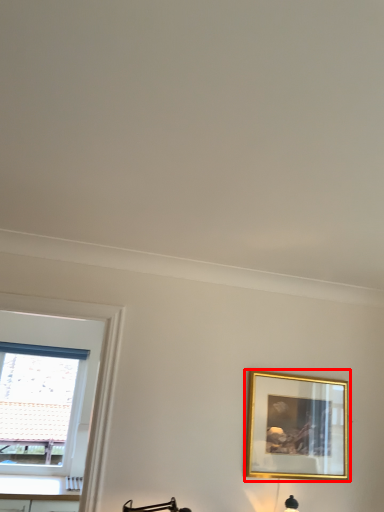
Question: From the image's perspective, where is picture frame (annotated by the red box) located relative to window?

Choices:
 (A) above
 (B) below

Answer: (A)